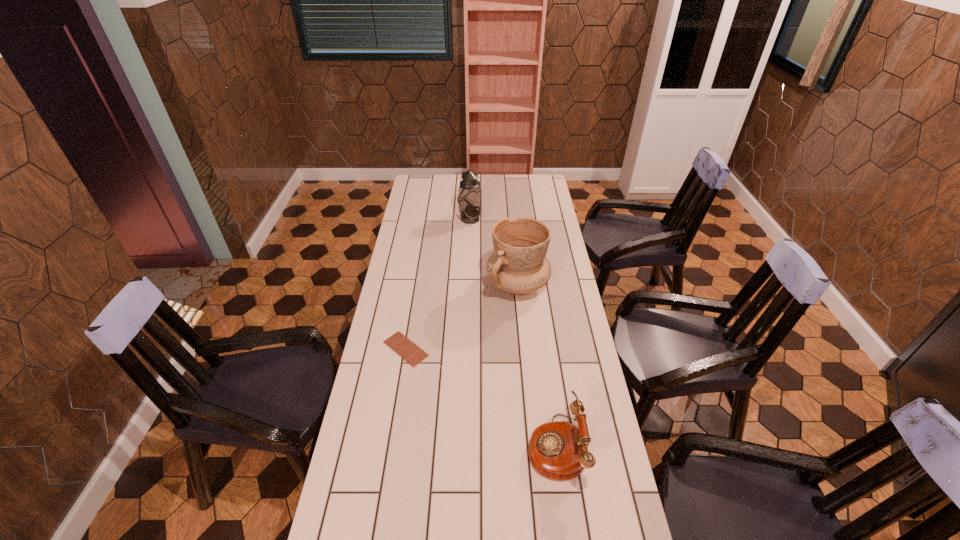
Identify the location of vacant area at the far right corner. (545, 179).

The height and width of the screenshot is (540, 960). I want to click on vacant space that is in between the second tallest object and the nearest object, so [537, 366].

At what (x,y) coordinates should I click in order to perform the action: click on empty location between the third tallest object and the chocolate bar. Please return your answer as a coordinate pair (x, y). Looking at the image, I should click on (481, 397).

This screenshot has width=960, height=540. What are the coordinates of `vacant area that lies between the second shortest object and the second farthest object` in the screenshot? It's located at (537, 366).

The height and width of the screenshot is (540, 960). Identify the location of vacant region between the leftmost object and the pottery. (462, 316).

You are a GUI agent. You are given a task and a screenshot of the screen. Output one action in this format:
    pyautogui.click(x=<x>, y=<y>)
    Task: Click on the unoccupied area between the pottery and the chocolate bar
    
    Given the screenshot: What is the action you would take?
    pyautogui.click(x=462, y=316)

This screenshot has height=540, width=960. What are the coordinates of `vacant area that lies between the tallest object and the chocolate bar` in the screenshot? It's located at (438, 284).

Where is `vacant area between the second shortest object and the third nearest object`? vacant area between the second shortest object and the third nearest object is located at coordinates (537, 366).

The width and height of the screenshot is (960, 540). In order to click on vacant space that is in between the telephone and the second farthest object in this screenshot , I will do pyautogui.click(x=537, y=366).

Where is `free spot between the second nearest object and the pottery`? The image size is (960, 540). free spot between the second nearest object and the pottery is located at coordinates (462, 316).